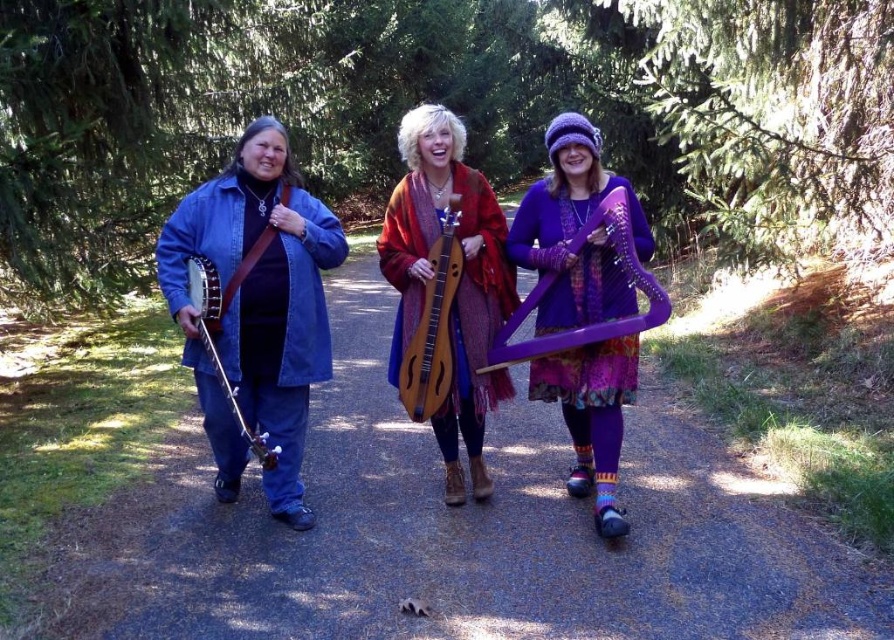
You are a photographer trying to capture a group photo of the denim jacket at left and the wooden dulcimer at center. Since you want to include both in the frame, which direction should you position yourself relative to the group to ensure both are fully visible?

You should position yourself facing the group from the front, as the denim jacket at left is on the left side of the wooden dulcimer at center, meaning they are aligned horizontally. By standing in front, you can capture both in the frame without any obstruction.

You are standing at the point labeled point [690,602] and want to walk towards the point labeled point [196,284]. Which direction should you face to walk directly towards it?

You should face towards the lower left direction because point [196,284] is located lower and to the left relative to point [690,602].